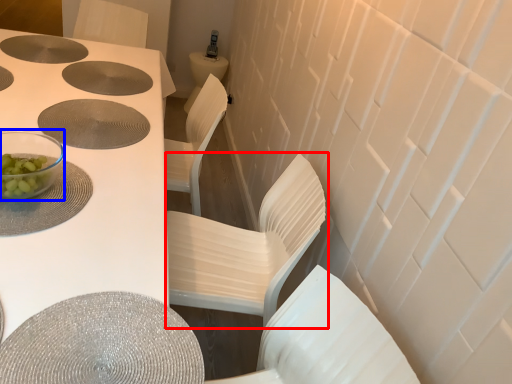
Question: Which of the following is the closest to the observer, chair (highlighted by a red box) or tableware (highlighted by a blue box)?

Choices:
 (A) chair
 (B) tableware

Answer: (B)